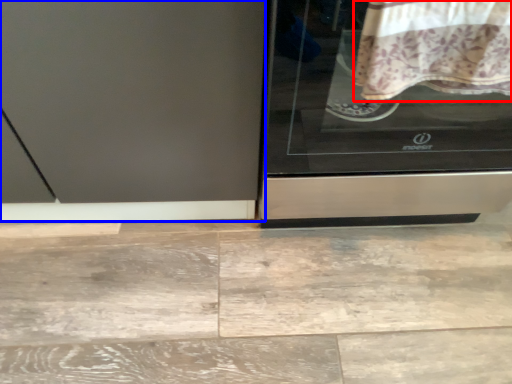
Question: Which of the following is the closest to the observer, blanket (highlighted by a red box) or screen door (highlighted by a blue box)?

Choices:
 (A) blanket
 (B) screen door

Answer: (A)